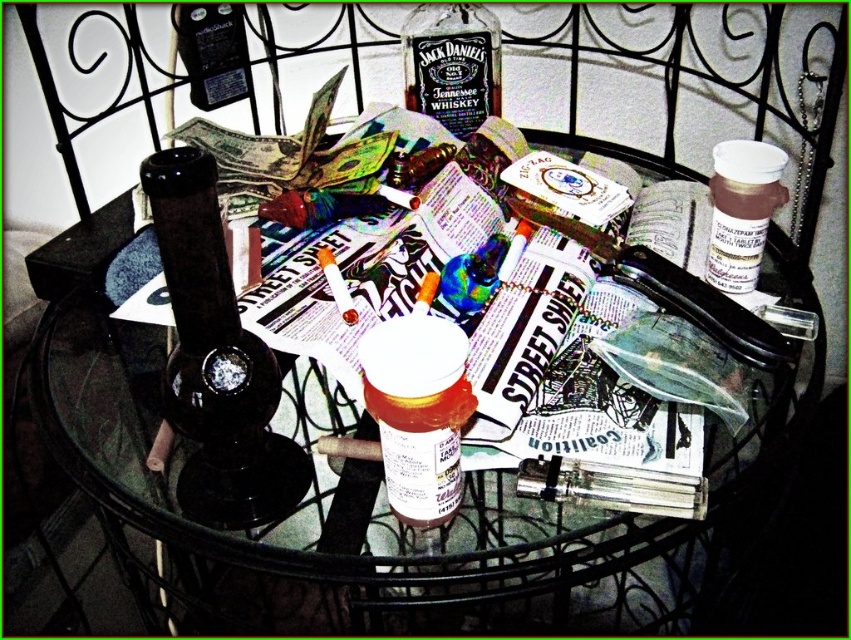
Which is in front, point (415, 371) or point (750, 260)?

Point (415, 371)

The width and height of the screenshot is (851, 640). What are the coordinates of `translucent plastic pill bottle at center` in the screenshot? It's located at (418, 412).

Image resolution: width=851 pixels, height=640 pixels. What do you see at coordinates (418, 412) in the screenshot?
I see `translucent plastic pill bottle at center` at bounding box center [418, 412].

Locate an element on the screen. This screenshot has height=640, width=851. translucent plastic pill bottle at center is located at coordinates (418, 412).

Is black glass bong at center below translucent plastic pill bottle at center?

Actually, black glass bong at center is above translucent plastic pill bottle at center.

Does black glass bong at center lie in front of translucent plastic pill bottle at center?

Yes, it is in front of translucent plastic pill bottle at center.

You are a GUI agent. You are given a task and a screenshot of the screen. Output one action in this format:
    pyautogui.click(x=<x>, y=<y>)
    Task: Click on the black glass bong at center
    This screenshot has height=640, width=851.
    Given the screenshot: What is the action you would take?
    pyautogui.click(x=216, y=360)

I want to click on black glass bong at center, so click(x=216, y=360).

Can you confirm if black glass bong at center is shorter than matte black bottle at upper center?

In fact, black glass bong at center may be taller than matte black bottle at upper center.

Between black glass bong at center and matte black bottle at upper center, which one has less height?

With less height is matte black bottle at upper center.

Locate an element on the screen. black glass bong at center is located at coordinates (216, 360).